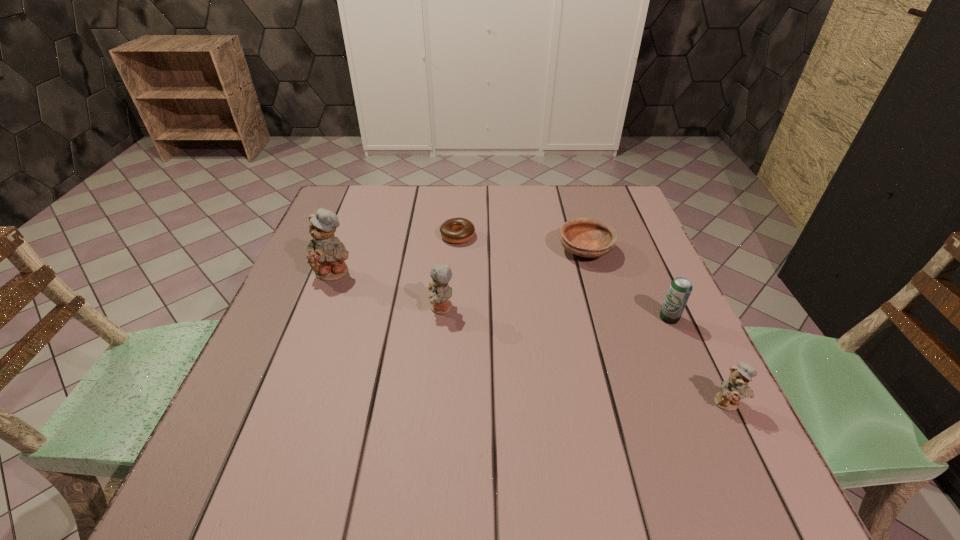
Where is `the tallest object`? the tallest object is located at coordinates (326, 256).

The width and height of the screenshot is (960, 540). What are the coordinates of `the leftmost teddy bear` in the screenshot? It's located at (326, 256).

The image size is (960, 540). What are the coordinates of `the second shortest teddy bear` in the screenshot? It's located at (440, 292).

Where is `the fifth shortest object`? The image size is (960, 540). the fifth shortest object is located at coordinates (440, 292).

Identify the location of the rightmost teddy bear. (736, 387).

The image size is (960, 540). Identify the location of the nearest teddy bear. (736, 387).

Image resolution: width=960 pixels, height=540 pixels. Find the location of `bowl`. bowl is located at coordinates (585, 237).

Image resolution: width=960 pixels, height=540 pixels. In order to click on the fifth tallest object in this screenshot , I will do `click(585, 237)`.

The image size is (960, 540). Find the location of `doughnut`. doughnut is located at coordinates (465, 228).

This screenshot has height=540, width=960. I want to click on beer can, so click(680, 288).